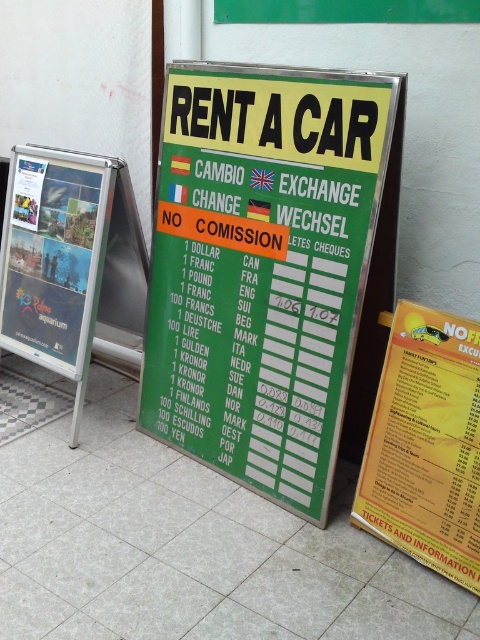
Question: Which object appears farthest from the camera in this image?

Choices:
 (A) metallic glossy poster at left
 (B) yellow paper menu at center

Answer: (A)

Question: Observing the image, what is the correct spatial positioning of yellow paper menu at center in reference to metallic glossy poster at left?

Choices:
 (A) right
 (B) left

Answer: (A)

Question: Is green plastic sign at center above yellow paper menu at center?

Choices:
 (A) yes
 (B) no

Answer: (A)

Question: Among these points, which one is nearest to the camera?

Choices:
 (A) (269, 248)
 (B) (63, 221)

Answer: (A)

Question: Observing the image, what is the correct spatial positioning of green plastic sign at center in reference to metallic glossy poster at left?

Choices:
 (A) left
 (B) right

Answer: (B)

Question: Which of the following is the farthest from the observer?

Choices:
 (A) (19, 308)
 (B) (388, 474)
 (C) (348, 180)

Answer: (A)